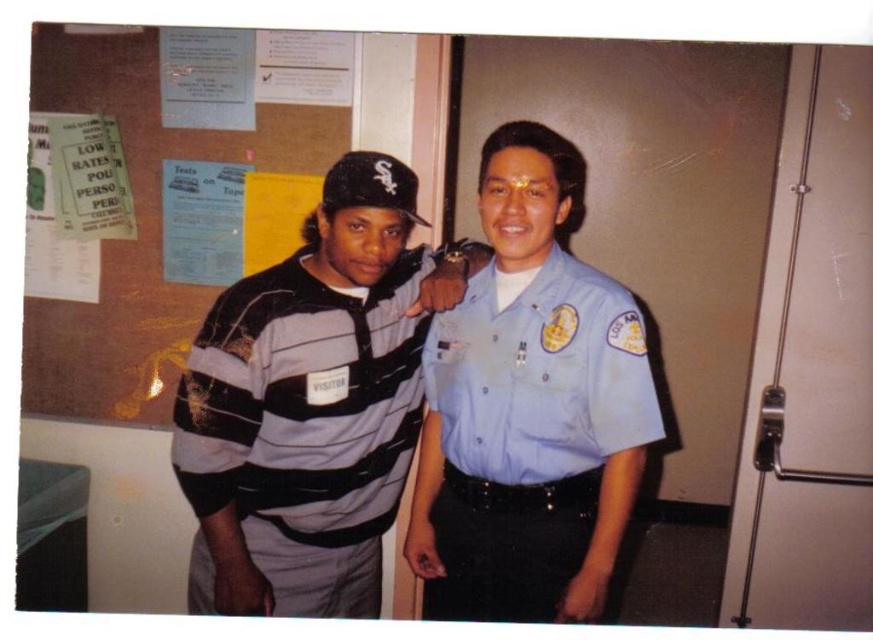
Which is in front, point (29, 353) or point (276, 536)?

Point (276, 536) is more forward.

Can you confirm if burlap bulletin board at upper left is taller than striped knit sweater at center?

Yes, burlap bulletin board at upper left is taller than striped knit sweater at center.

Is point (294, 86) farther from camera compared to point (313, 484)?

Yes, point (294, 86) is farther from viewer.

Where is `burlap bulletin board at upper left`? The image size is (873, 640). burlap bulletin board at upper left is located at coordinates (184, 188).

Is striped knit sweater at center positioned in front of light blue fabric shirt at center?

No, it is not.

Between point (237, 300) and point (558, 468), which one is positioned in front?

Point (237, 300)

You are a GUI agent. You are given a task and a screenshot of the screen. Output one action in this format:
    pyautogui.click(x=<x>, y=<y>)
    Task: Click on the striped knit sweater at center
    The height and width of the screenshot is (640, 873).
    Given the screenshot: What is the action you would take?
    pyautogui.click(x=303, y=429)

Locate an element on the screen. Image resolution: width=873 pixels, height=640 pixels. striped knit sweater at center is located at coordinates [303, 429].

How distant is burlap bulletin board at upper left from light blue fabric shirt at center?

burlap bulletin board at upper left is 29.93 inches from light blue fabric shirt at center.

What are the coordinates of `burlap bulletin board at upper left` in the screenshot? It's located at (184, 188).